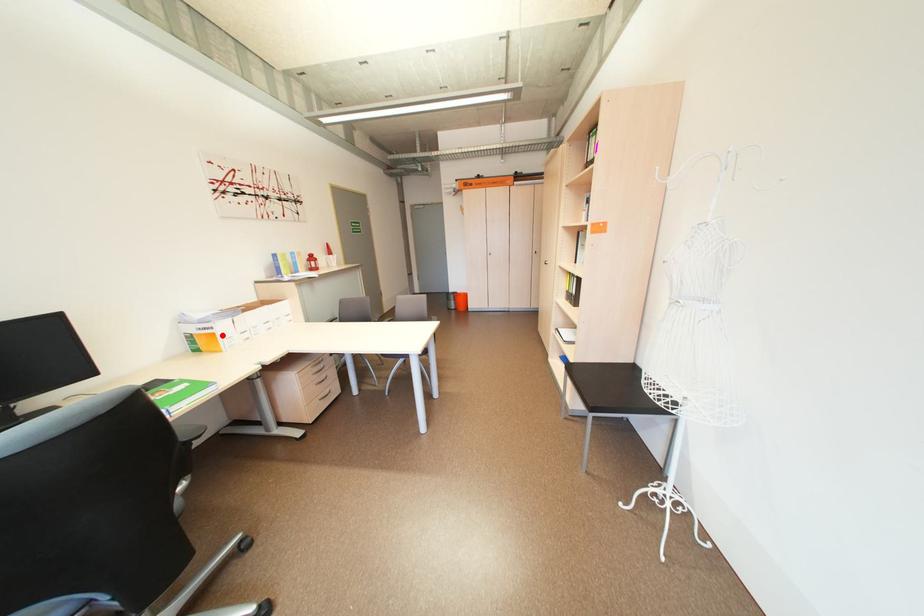
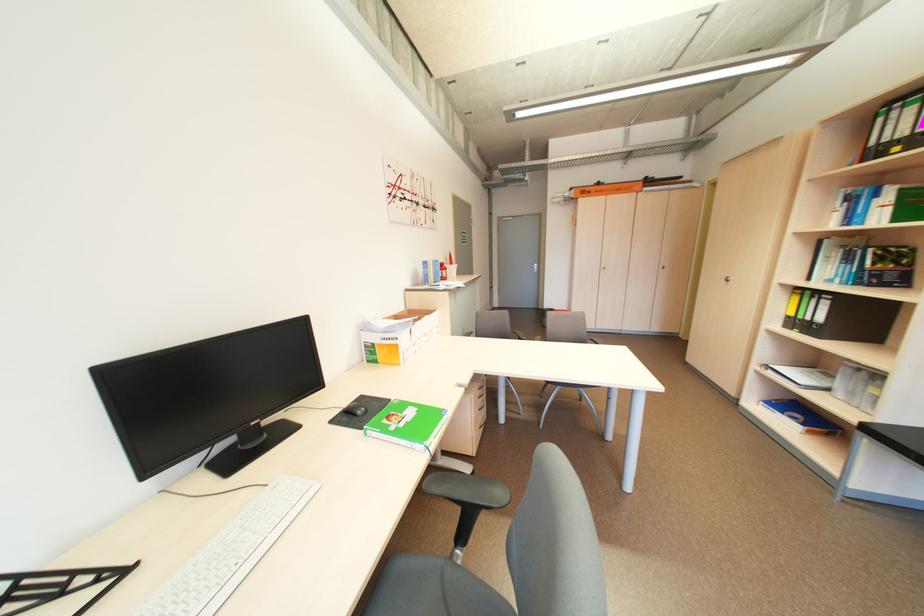
Where in the second image is the point corresponding to the highlighted location from the first image?

(406, 347)